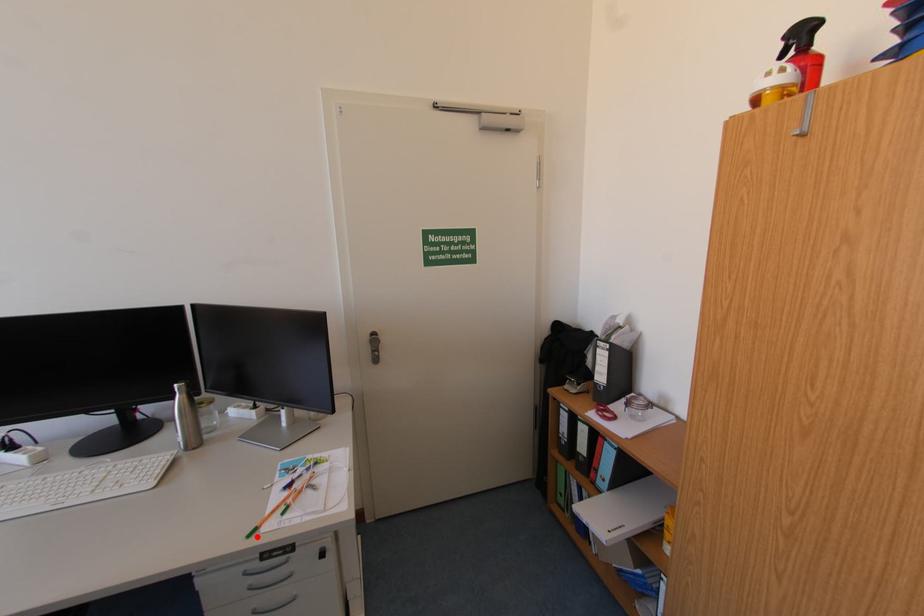
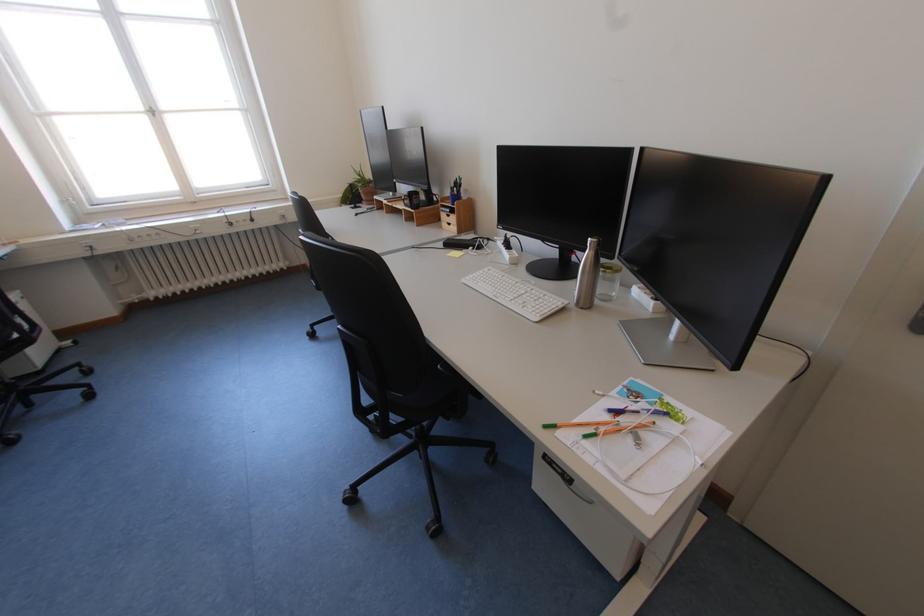
Find the pixel in the second image that matches the highlighted location in the first image.

(553, 428)